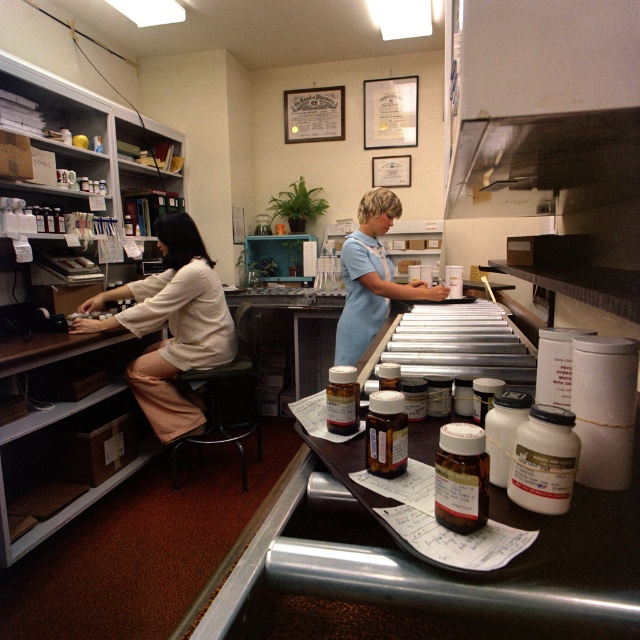
Question: Which object is closer to the camera taking this photo?

Choices:
 (A) matte white blouse at left
 (B) light blue uniform at center

Answer: (A)

Question: Is matte white blouse at left below light blue uniform at center?

Choices:
 (A) yes
 (B) no

Answer: (A)

Question: Is matte white blouse at left to the right of light blue uniform at center from the viewer's perspective?

Choices:
 (A) no
 (B) yes

Answer: (A)

Question: Does matte white blouse at left have a larger size compared to light blue uniform at center?

Choices:
 (A) no
 (B) yes

Answer: (B)